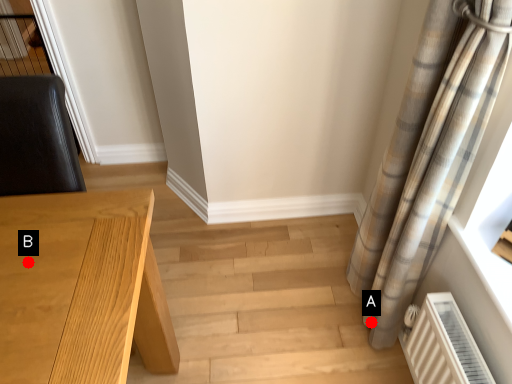
Question: Two points are circled on the image, labeled by A and B beside each circle. Which point appears closest to the camera in this image?

Choices:
 (A) A is closer
 (B) B is closer

Answer: (B)